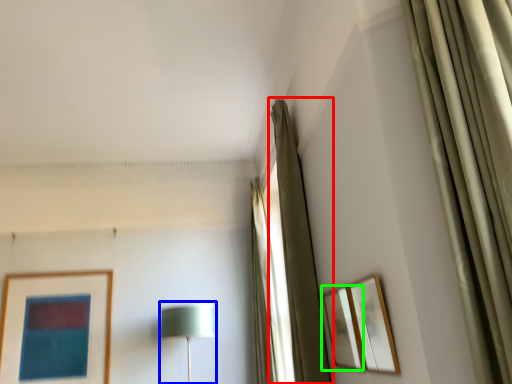
Question: Which object is positioned closest to curtain (highlighted by a red box)? Select from table lamp (highlighted by a blue box) and picture frame (highlighted by a green box).

Choices:
 (A) table lamp
 (B) picture frame

Answer: (B)